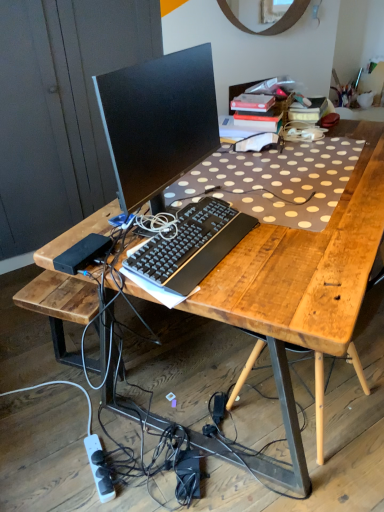
Image resolution: width=384 pixels, height=512 pixels. I want to click on vacant space to the right of white plastic power strip at lower left, so click(139, 463).